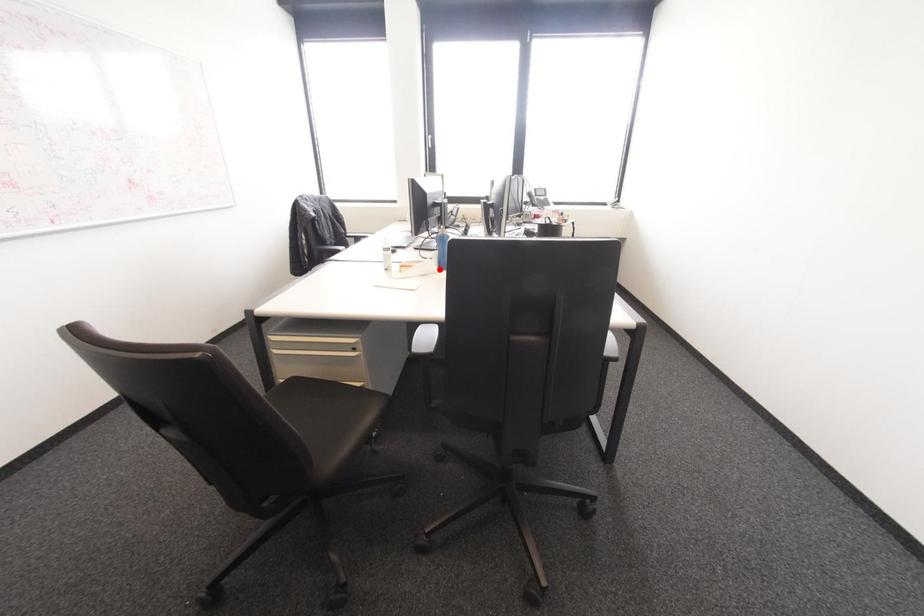
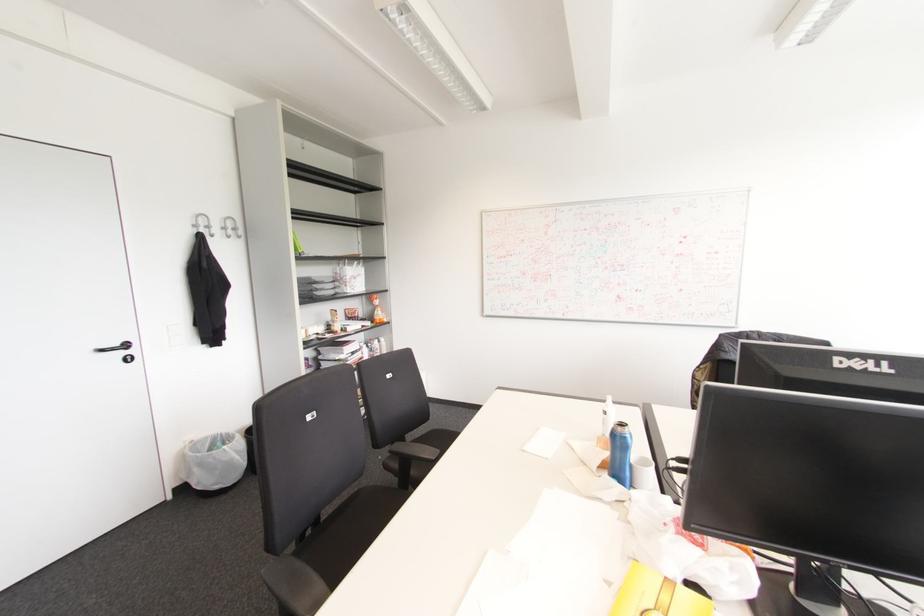
In the second image, find the point that corresponds to the highlighted location in the first image.

(611, 479)